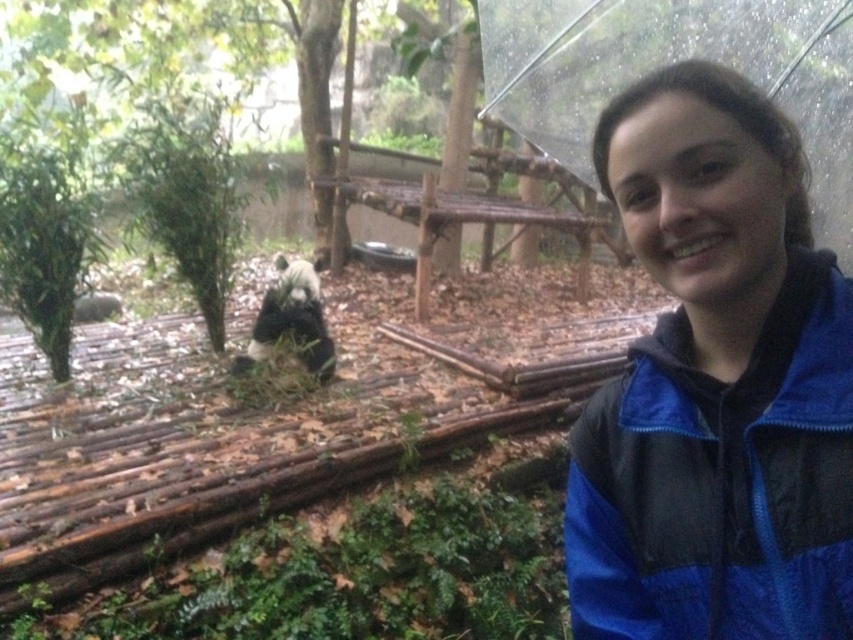
You are a photographer trying to capture a clear shot of the transparent plastic umbrella at upper right without the blue synthetic jacket at lower right blocking it. Is the jacket in the way of the umbrella?

The blue synthetic jacket at lower right is closer to the viewer than the transparent plastic umbrella at upper right, so the jacket is blocking the umbrella and would interfere with the shot.

You are a photographer trying to capture a photo of the panda. You have a blue synthetic jacket at lower right and a transparent plastic umbrella at upper right in your shot. Which object is closer to the camera?

The blue synthetic jacket at lower right is closer to the camera because it is shorter than the transparent plastic umbrella at upper right, meaning it would appear lower in the frame and thus nearer.